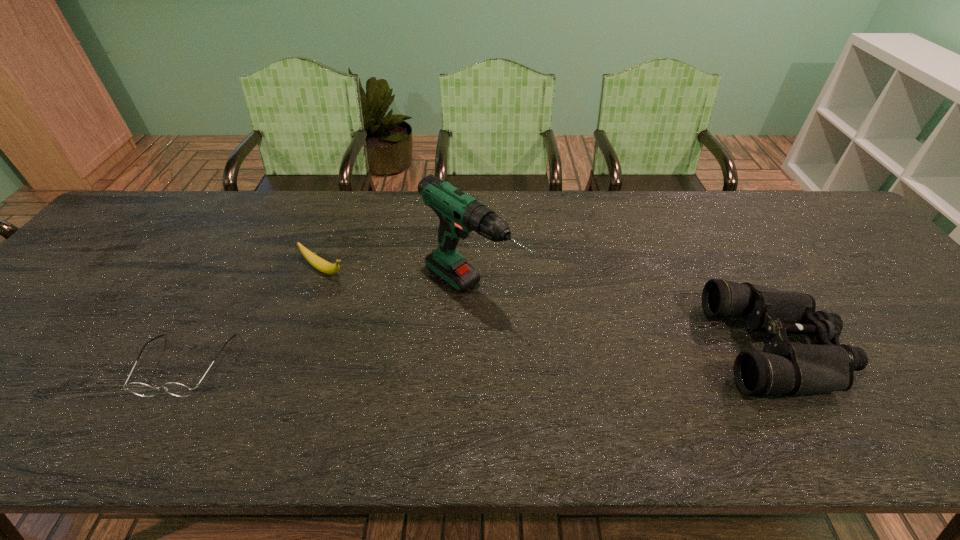
At what (x,y) coordinates should I click in order to perform the action: click on the leftmost object. Please return your answer as a coordinate pair (x, y). This screenshot has width=960, height=540. Looking at the image, I should click on (141, 389).

Locate an element on the screen. The image size is (960, 540). the shortest object is located at coordinates (141, 389).

Where is `the rightmost object`? The image size is (960, 540). the rightmost object is located at coordinates (783, 367).

The image size is (960, 540). In order to click on the second object from left to right in this screenshot , I will do `click(317, 262)`.

The width and height of the screenshot is (960, 540). In order to click on the second shortest object in this screenshot , I will do `click(317, 262)`.

Where is `the second object from right to left`? This screenshot has height=540, width=960. the second object from right to left is located at coordinates [459, 214].

What are the coordinates of `the tallest object` in the screenshot? It's located at (459, 214).

Locate an element on the screen. free point located 0.200m through the eyepieces of the rightmost object is located at coordinates [925, 347].

Identify the location of vacant space located 0.370m at the stem of the banana. Image resolution: width=960 pixels, height=540 pixels. (456, 343).

I want to click on vacant space located at the stem of the banana, so click(439, 334).